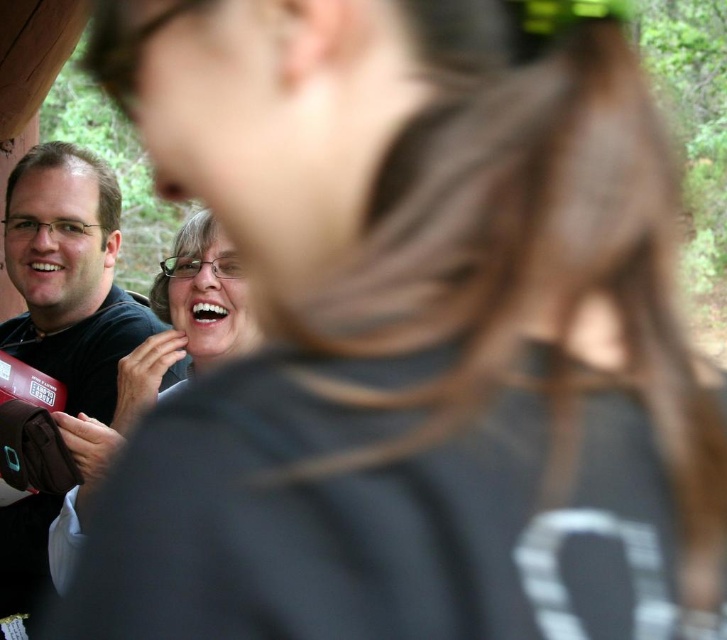
Question: Is matte black shirt at left positioned before matte black shirt at center?

Choices:
 (A) yes
 (B) no

Answer: (B)

Question: Can you confirm if matte black shirt at left is bigger than matte black shirt at center?

Choices:
 (A) yes
 (B) no

Answer: (A)

Question: Is matte black shirt at left to the right of matte black shirt at center from the viewer's perspective?

Choices:
 (A) no
 (B) yes

Answer: (A)